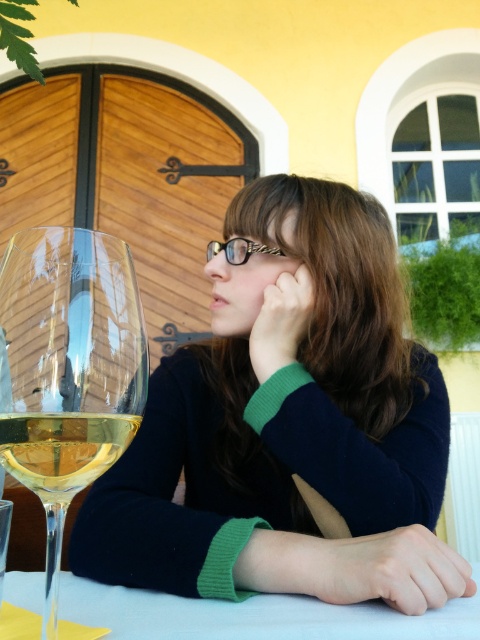
Does transparent glass wine glass at lower left have a smaller size compared to gold chain-link glasses at center?

Indeed, transparent glass wine glass at lower left has a smaller size compared to gold chain-link glasses at center.

Between transparent glass wine glass at lower left and gold chain-link glasses at center, which one is positioned higher?

gold chain-link glasses at center is higher up.

Is point (137, 294) positioned in front of point (206, 252)?

Yes, point (137, 294) is closer to viewer.

The image size is (480, 640). In order to click on transparent glass wine glass at lower left in this screenshot , I will do `click(68, 369)`.

Is point (228, 483) positioned before point (96, 308)?

No.

Does point (348, 426) come in front of point (84, 436)?

No, (348, 426) is behind (84, 436).

Identify the location of matte glass wine glass at left. The height and width of the screenshot is (640, 480). (288, 426).

Between matte glass wine glass at left and gold chain-link glasses at center, which one has less height?

gold chain-link glasses at center

Is point (295, 307) positioned after point (260, 252)?

That is False.

Between point (278, 276) and point (216, 252), which one is positioned behind?

The point (216, 252) is more distant.

Find the location of `matte glass wine glass at left`. matte glass wine glass at left is located at coordinates (288, 426).